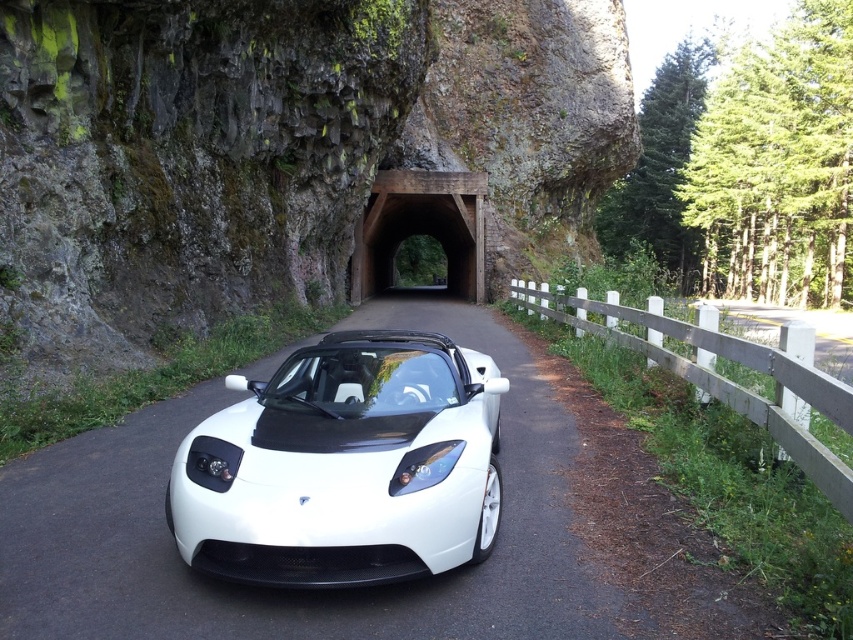
Can you confirm if white matte car at center is positioned above brown wooden tunnel at center?

No, white matte car at center is not above brown wooden tunnel at center.

Which is behind, point (136, 497) or point (383, 236)?

Positioned behind is point (383, 236).

Locate an element on the screen. white matte car at center is located at coordinates click(x=392, y=584).

I want to click on white matte car at center, so click(x=392, y=584).

Is white matte sports car at center shorter than brown wooden tunnel at center?

Indeed, white matte sports car at center has a lesser height compared to brown wooden tunnel at center.

Locate an element on the screen. The image size is (853, 640). white matte sports car at center is located at coordinates (345, 465).

Measure the distance from white matte car at center to white matte sports car at center.

The distance of white matte car at center from white matte sports car at center is 1.09 meters.

Can you confirm if white matte car at center is bigger than white matte sports car at center?

Correct, white matte car at center is larger in size than white matte sports car at center.

Find the location of a particular element. The height and width of the screenshot is (640, 853). white matte car at center is located at coordinates (392, 584).